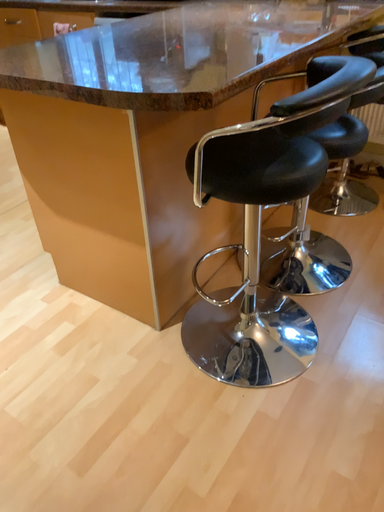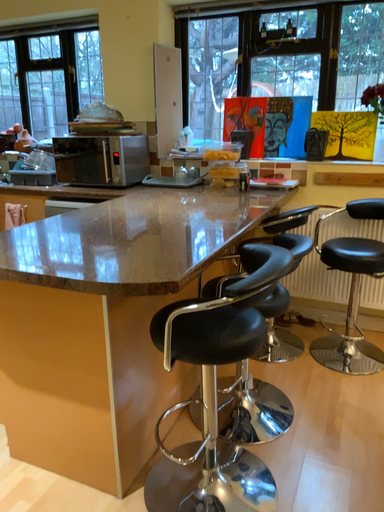
Question: Which way did the camera rotate in the video?

Choices:
 (A) rotated right
 (B) rotated left

Answer: (A)